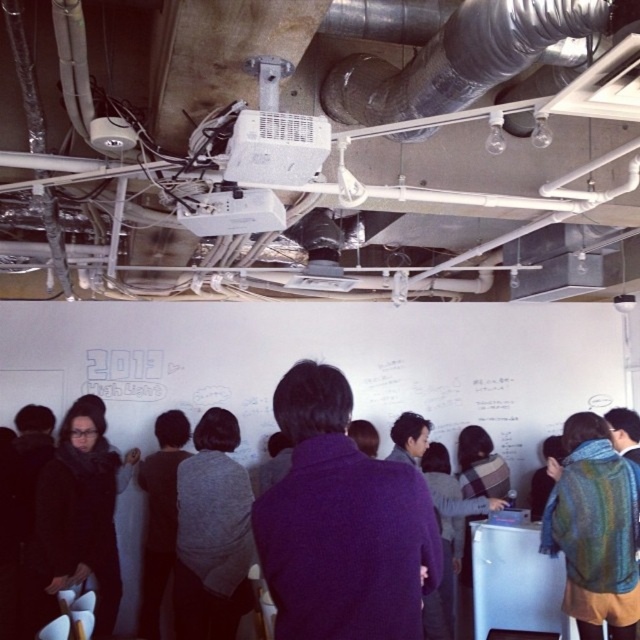
Does purple wool sweater at center have a greater width compared to metallic flexible duct at upper center?

Incorrect, purple wool sweater at center's width does not surpass metallic flexible duct at upper center's.

Does point (410, 634) lie in front of point (371, 96)?

Yes, point (410, 634) is closer to viewer.

At what (x,y) coordinates should I click in order to perform the action: click on purple wool sweater at center. Please return your answer as a coordinate pair (x, y). This screenshot has height=640, width=640. Looking at the image, I should click on (340, 524).

Does striped wool scarf at center have a larger size compared to matte black scarf at center?

Actually, striped wool scarf at center might be smaller than matte black scarf at center.

Is striped wool scarf at center to the right of matte black scarf at center from the viewer's perspective?

Indeed, striped wool scarf at center is positioned on the right side of matte black scarf at center.

Where is `striped wool scarf at center`? This screenshot has height=640, width=640. striped wool scarf at center is located at coordinates (595, 529).

Does point (288, 362) come closer to viewer compared to point (308, 403)?

That is False.

Does white matte whiteboard at center have a lesser width compared to purple wool sweater at center?

Incorrect, white matte whiteboard at center's width is not less than purple wool sweater at center's.

You are a GUI agent. You are given a task and a screenshot of the screen. Output one action in this format:
    pyautogui.click(x=<x>, y=<y>)
    Task: Click on the white matte whiteboard at center
    The height and width of the screenshot is (640, 640).
    Given the screenshot: What is the action you would take?
    pyautogui.click(x=321, y=362)